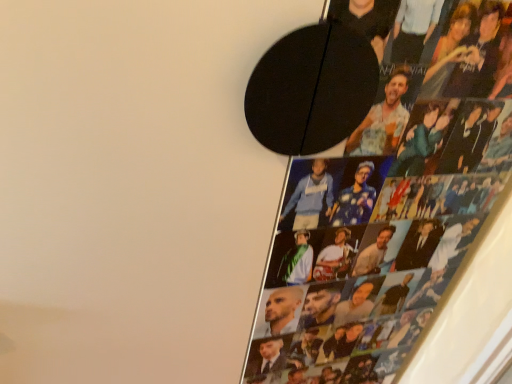
Describe the element at coordinates (390, 212) in the screenshot. The height and width of the screenshot is (384, 512). I see `matte black circular object at upper right` at that location.

In order to click on matte black circular object at upper right in this screenshot , I will do `click(390, 212)`.

Measure the distance between matte black circular object at upper right and camera.

matte black circular object at upper right and camera are 20.42 inches apart from each other.

This screenshot has width=512, height=384. Identify the location of matte black circular object at upper right. (390, 212).